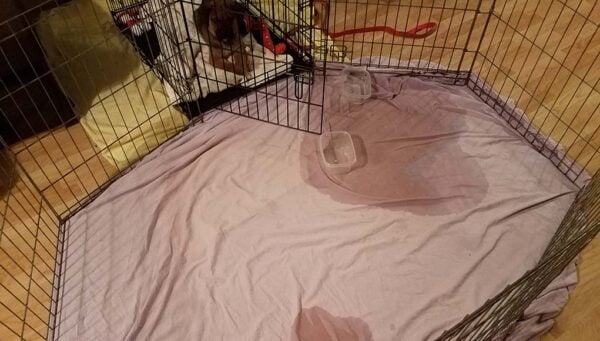
Identify the location of plastic bowl. (356, 179).